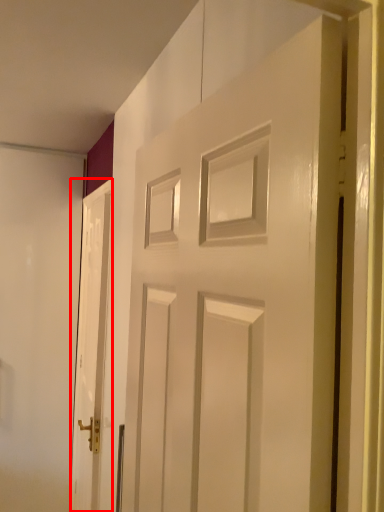
Question: From the image's perspective, what is the correct spatial positioning of door (annotated by the red box) in reference to door?

Choices:
 (A) above
 (B) below

Answer: (B)